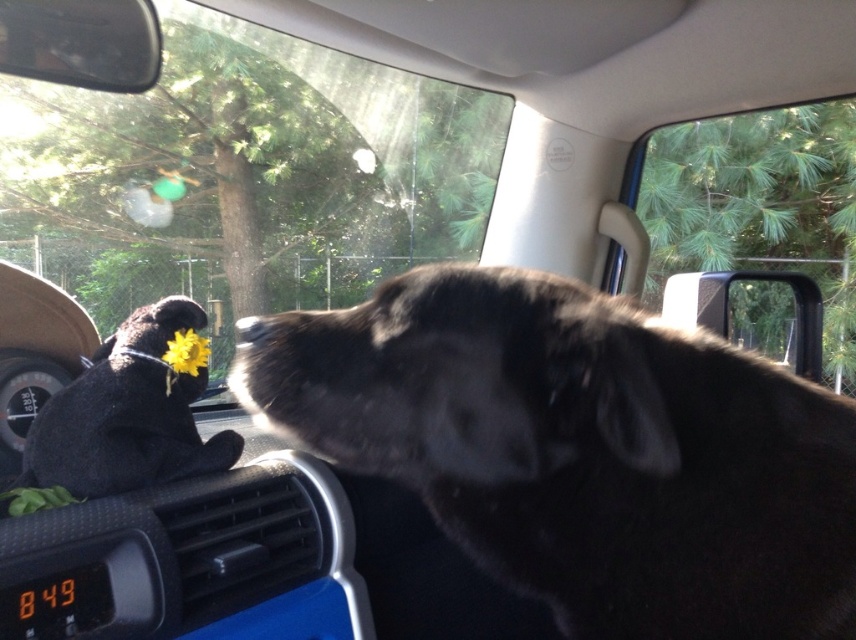
You are a passenger in a car and want to check the time on the dashboard clock. You notice the black fur dog at center and the clear glass window at upper right. Which object is closer to you?

The black fur dog at center is closer to you than the clear glass window at upper right because they are 4.93 meters apart.

You are sitting in the passenger seat of a car and want to reach the transparent glass window at center to adjust the temperature. Can you comfortably reach it from your current position?

The transparent glass window at center is 14.03 feet from the viewer, which is too far to comfortably reach from the passenger seat. You would need to move closer or ask someone else to assist.

You are a delivery robot with a 2.5 meter long package. You need to place the package horizontally between the transparent glass window at center and the clear glass window at upper right. Can the package fit in that space?

The distance between the transparent glass window at center and the clear glass window at upper right is 2.86 meters, so the 2.5 meter long package can fit in that space since it is shorter than the available distance.